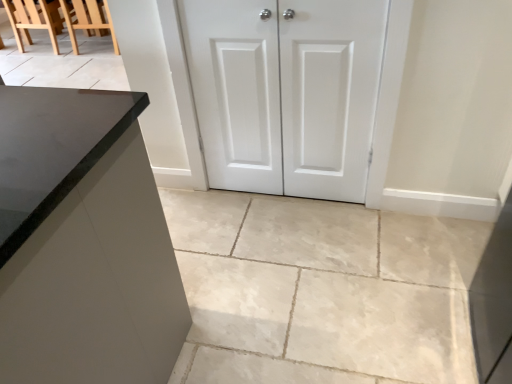
What is the approximate height of white matte cabinet doors at center?

white matte cabinet doors at center is 36.12 inches in height.

Looking at this image, what is the approximate height of white matte cabinet doors at center?

white matte cabinet doors at center is 37.44 inches tall.

Where is `wooden chair at upper left, marked as the first chair in a right-to-left arrangement`? wooden chair at upper left, marked as the first chair in a right-to-left arrangement is located at coordinates (56, 19).

Are slate gray stone countertop at left and white matte cabinet doors at center beside each other?

No, slate gray stone countertop at left is not making contact with white matte cabinet doors at center.

Does slate gray stone countertop at left turn towards white matte cabinet doors at center?

No.

Is slate gray stone countertop at left positioned behind white matte cabinet doors at center?

No.

Locate an element on the screen. countertop in front of the white matte cabinet doors at center is located at coordinates (52, 149).

Is the position of wooden chair at upper left, acting as the first chair starting from the left, less distant than that of slate gray stone countertop at left?

No, wooden chair at upper left, acting as the first chair starting from the left, is further to the viewer.

From a real-world perspective, is wooden chair at upper left, acting as the first chair starting from the left, beneath slate gray stone countertop at left?

A: Indeed, from a real-world perspective, wooden chair at upper left, acting as the first chair starting from the left, is positioned beneath slate gray stone countertop at left.

Is wooden chair at upper left, which is counted as the 2th chair, starting from the right, positioned far away from slate gray stone countertop at left?

Indeed, wooden chair at upper left, which is counted as the 2th chair, starting from the right, is not near slate gray stone countertop at left.

From the image's perspective, is wooden chair at upper left, acting as the first chair starting from the left, above slate gray stone countertop at left?

Yes.

From the image's perspective, which is below, white matte cabinet doors at center or wooden chair at upper left, acting as the first chair starting from the left?

white matte cabinet doors at center is shown below in the image.

Is wooden chair at upper left, which is counted as the 2th chair, starting from the right, surrounded by white matte cabinet doors at center?

No, white matte cabinet doors at center does not contain wooden chair at upper left, which is counted as the 2th chair, starting from the right.

Which of these two, white matte cabinet doors at center or wooden chair at upper left, acting as the first chair starting from the left, stands taller?

white matte cabinet doors at center is taller.

Does point (229, 141) lie in front of point (54, 21)?

That is True.

From a real-world perspective, between wooden chair at upper left, arranged as the 2th chair when viewed from the left, and slate gray stone countertop at left, who is vertically higher?

From a 3D spatial view, slate gray stone countertop at left is above.

Identify the location of countertop located in front of the wooden chair at upper left, marked as the first chair in a right-to-left arrangement. The width and height of the screenshot is (512, 384). (52, 149).

Which is more to the left, wooden chair at upper left, arranged as the 2th chair when viewed from the left, or slate gray stone countertop at left?

From the viewer's perspective, wooden chair at upper left, arranged as the 2th chair when viewed from the left, appears more on the left side.

Considering the points (54, 33) and (62, 161), which point is in front, point (54, 33) or point (62, 161)?

The point (62, 161) is in front.

From the image's perspective, is wooden chair at upper left, acting as the first chair starting from the left, positioned above or below white matte cabinet doors at center?

wooden chair at upper left, acting as the first chair starting from the left, is above white matte cabinet doors at center.

Is wooden chair at upper left, acting as the first chair starting from the left, located outside white matte cabinet doors at center?

Yes, wooden chair at upper left, acting as the first chair starting from the left, is not within white matte cabinet doors at center.

Is wooden chair at upper left, which is counted as the 2th chair, starting from the right, far from white matte cabinet doors at center?

That's right, there is a large distance between wooden chair at upper left, which is counted as the 2th chair, starting from the right, and white matte cabinet doors at center.

From the picture: Who is taller, wooden chair at upper left, acting as the first chair starting from the left, or white matte cabinet doors at center?

white matte cabinet doors at center is taller.

Between slate gray stone countertop at left and wooden chair at upper left, marked as the first chair in a right-to-left arrangement, which one is positioned in front?

slate gray stone countertop at left.

Can you confirm if slate gray stone countertop at left is bigger than wooden chair at upper left, marked as the first chair in a right-to-left arrangement?

Incorrect, slate gray stone countertop at left is not larger than wooden chair at upper left, marked as the first chair in a right-to-left arrangement.

Would you say slate gray stone countertop at left is to the left or to the right of wooden chair at upper left, arranged as the 2th chair when viewed from the left, in the picture?

Clearly, slate gray stone countertop at left is on the right of wooden chair at upper left, arranged as the 2th chair when viewed from the left, in the image.

Is slate gray stone countertop at left wider than wooden chair at upper left, arranged as the 2th chair when viewed from the left?

In fact, slate gray stone countertop at left might be narrower than wooden chair at upper left, arranged as the 2th chair when viewed from the left.

From the image's perspective, would you say slate gray stone countertop at left is shown under wooden chair at upper left, which is counted as the 2th chair, starting from the right?

Yes, from the image's perspective, slate gray stone countertop at left is below wooden chair at upper left, which is counted as the 2th chair, starting from the right.

Is slate gray stone countertop at left smaller than wooden chair at upper left, which is counted as the 2th chair, starting from the right?

No, slate gray stone countertop at left is not smaller than wooden chair at upper left, which is counted as the 2th chair, starting from the right.

Is slate gray stone countertop at left positioned far away from wooden chair at upper left, acting as the first chair starting from the left?

Yes, slate gray stone countertop at left and wooden chair at upper left, acting as the first chair starting from the left, are quite far apart.

Is point (140, 108) farther from viewer compared to point (40, 17)?

No, it is not.

Identify the location of countertop below the white matte cabinet doors at center (from the image's perspective). The height and width of the screenshot is (384, 512). (52, 149).

Locate an element on the screen. Image resolution: width=512 pixels, height=384 pixels. countertop on the right side of wooden chair at upper left, acting as the first chair starting from the left is located at coordinates (52, 149).

When comparing their distances from white matte cabinet doors at center, does wooden chair at upper left, arranged as the 2th chair when viewed from the left, or wooden chair at upper left, acting as the first chair starting from the left, seem closer?

wooden chair at upper left, arranged as the 2th chair when viewed from the left, is closer to white matte cabinet doors at center.

From the image, which object appears to be farther from white matte cabinet doors at center, white matte cabinet doors at center or wooden chair at upper left, arranged as the 2th chair when viewed from the left?

The object further to white matte cabinet doors at center is wooden chair at upper left, arranged as the 2th chair when viewed from the left.

In the scene shown: Estimate the real-world distances between objects in this image. Which object is further from slate gray stone countertop at left, wooden chair at upper left, which is counted as the 2th chair, starting from the right, or white matte cabinet doors at center?

Among the two, wooden chair at upper left, which is counted as the 2th chair, starting from the right, is located further to slate gray stone countertop at left.

Estimate the real-world distances between objects in this image. Which object is further from slate gray stone countertop at left, white matte cabinet doors at center or white matte cabinet doors at center?

Based on the image, white matte cabinet doors at center appears to be further to slate gray stone countertop at left.

Looking at this image, from the image, which object appears to be farther from wooden chair at upper left, marked as the first chair in a right-to-left arrangement, wooden chair at upper left, which is counted as the 2th chair, starting from the right, or slate gray stone countertop at left?

slate gray stone countertop at left lies further to wooden chair at upper left, marked as the first chair in a right-to-left arrangement, than the other object.

Based on their spatial positions, is white matte cabinet doors at center or white matte cabinet doors at center further from wooden chair at upper left, arranged as the 2th chair when viewed from the left?

white matte cabinet doors at center is positioned further to the anchor wooden chair at upper left, arranged as the 2th chair when viewed from the left.

Consider the image. Estimate the real-world distances between objects in this image. Which object is further from white matte cabinet doors at center, slate gray stone countertop at left or white matte cabinet doors at center?

Among the two, slate gray stone countertop at left is located further to white matte cabinet doors at center.

Looking at the image, which one is located closer to white matte cabinet doors at center, white matte cabinet doors at center or wooden chair at upper left, arranged as the 2th chair when viewed from the left?

The object closer to white matte cabinet doors at center is white matte cabinet doors at center.

Image resolution: width=512 pixels, height=384 pixels. What are the coordinates of `screen door between slate gray stone countertop at left and wooden chair at upper left, which is counted as the 2th chair, starting from the right, along the z-axis` in the screenshot? It's located at (236, 90).

The width and height of the screenshot is (512, 384). Find the location of `screen door located between white matte cabinet doors at center and wooden chair at upper left, which is counted as the 2th chair, starting from the right, in the depth direction`. screen door located between white matte cabinet doors at center and wooden chair at upper left, which is counted as the 2th chair, starting from the right, in the depth direction is located at coordinates (236, 90).

The height and width of the screenshot is (384, 512). Find the location of `chair positioned between slate gray stone countertop at left and wooden chair at upper left, acting as the first chair starting from the left, from near to far`. chair positioned between slate gray stone countertop at left and wooden chair at upper left, acting as the first chair starting from the left, from near to far is located at coordinates coord(56,19).

Find the location of `screen door between slate gray stone countertop at left and wooden chair at upper left, marked as the first chair in a right-to-left arrangement, in the front-back direction`. screen door between slate gray stone countertop at left and wooden chair at upper left, marked as the first chair in a right-to-left arrangement, in the front-back direction is located at coordinates (236, 90).